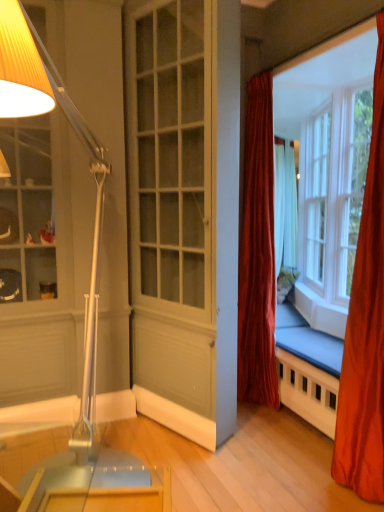
Find the location of `vacant area in front of white painted wood screen door at center`. vacant area in front of white painted wood screen door at center is located at coordinates (215, 471).